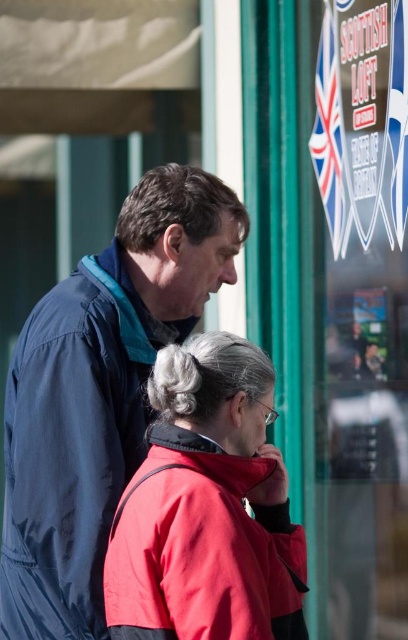
Which is above, matte blue jacket at center or red matte jacket at lower center?

matte blue jacket at center is above.

Between point (13, 572) and point (188, 376), which one is positioned behind?

The point (13, 572) is behind.

This screenshot has height=640, width=408. Identify the location of matte blue jacket at center. (99, 392).